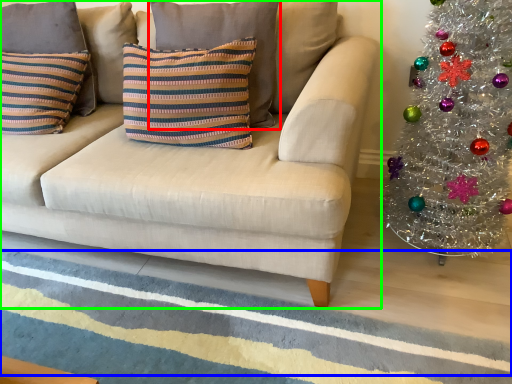
Question: Considering the real-world distances, which object is closest to pillow (highlighted by a red box)? stripe (highlighted by a blue box) or studio couch (highlighted by a green box).

Choices:
 (A) stripe
 (B) studio couch

Answer: (B)